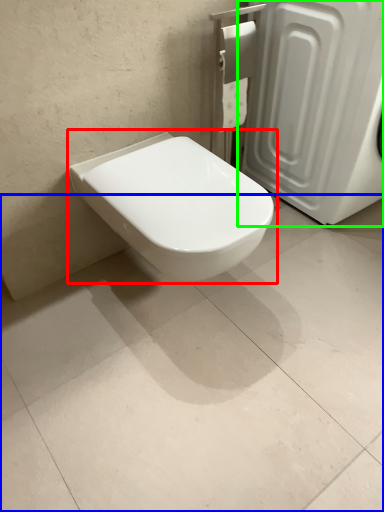
Question: Based on their relative distances, which object is farther from toilet (highlighted by a red box)? Choose from concrete (highlighted by a blue box) and screen door (highlighted by a green box).

Choices:
 (A) concrete
 (B) screen door

Answer: (B)